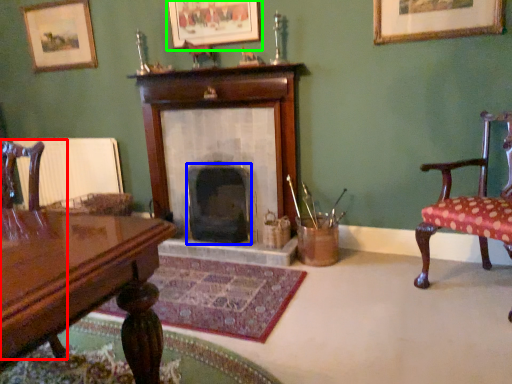
Question: Which object is positioned farthest from chair (highlighted by a red box)? Select from fireplace (highlighted by a blue box) and picture frame (highlighted by a green box).

Choices:
 (A) fireplace
 (B) picture frame

Answer: (B)